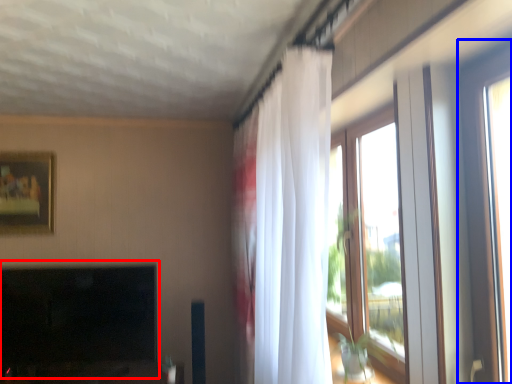
Question: Among these objects, which one is farthest to the camera, fireplace (highlighted by a red box) or window (highlighted by a blue box)?

Choices:
 (A) fireplace
 (B) window

Answer: (A)